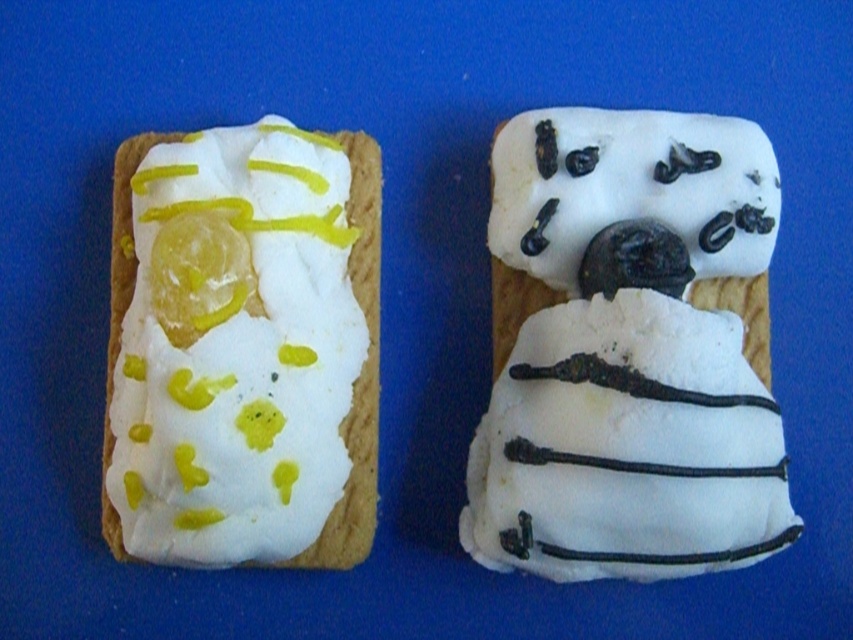
Question: Is white fondant figure at center wider than white cream cheese at left?

Choices:
 (A) no
 (B) yes

Answer: (B)

Question: Which object is closer to the camera taking this photo?

Choices:
 (A) white cream cheese at left
 (B) white matte frosting at center

Answer: (A)

Question: Among these objects, which one is farthest from the camera?

Choices:
 (A) white fondant figure at center
 (B) white cream cheese at left
 (C) white matte frosting at center

Answer: (C)

Question: Is white fondant figure at center thinner than white matte frosting at center?

Choices:
 (A) no
 (B) yes

Answer: (A)

Question: Which object is positioned closest to the white cream cheese at left?

Choices:
 (A) white matte frosting at center
 (B) white fondant figure at center

Answer: (B)

Question: From the image, what is the correct spatial relationship of white matte frosting at center in relation to white cream cheese at left?

Choices:
 (A) below
 (B) above

Answer: (B)